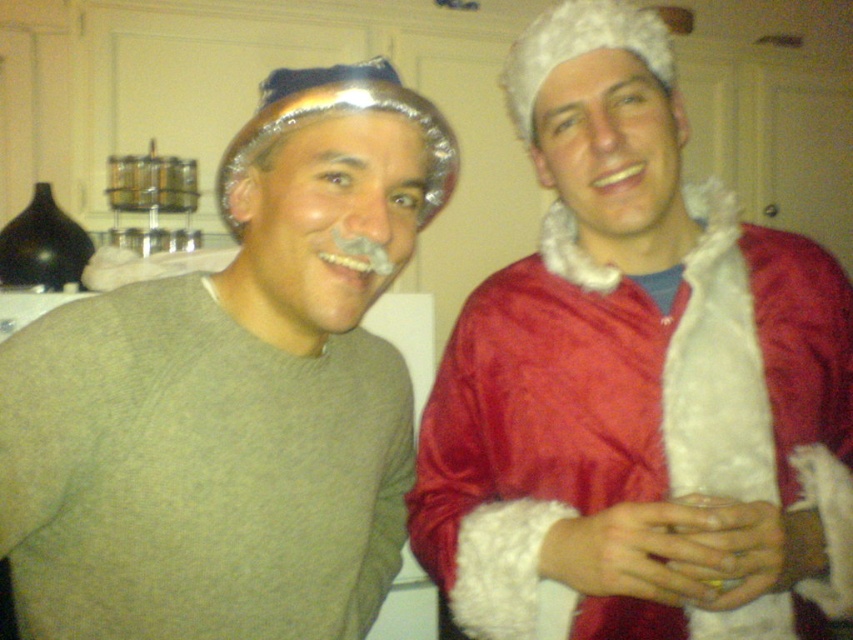
Question: Does red velvet santa coat at right come behind matte gray sweater at left?

Choices:
 (A) no
 (B) yes

Answer: (B)

Question: Which object appears farthest from the camera in this image?

Choices:
 (A) red velvet santa coat at right
 (B) matte gray sweater at left

Answer: (A)

Question: Which object is closer to the camera taking this photo?

Choices:
 (A) red velvet santa coat at right
 (B) matte gray sweater at left

Answer: (B)

Question: Is red velvet santa coat at right to the left of matte gray sweater at left from the viewer's perspective?

Choices:
 (A) yes
 (B) no

Answer: (B)

Question: Is red velvet santa coat at right wider than matte gray sweater at left?

Choices:
 (A) yes
 (B) no

Answer: (A)